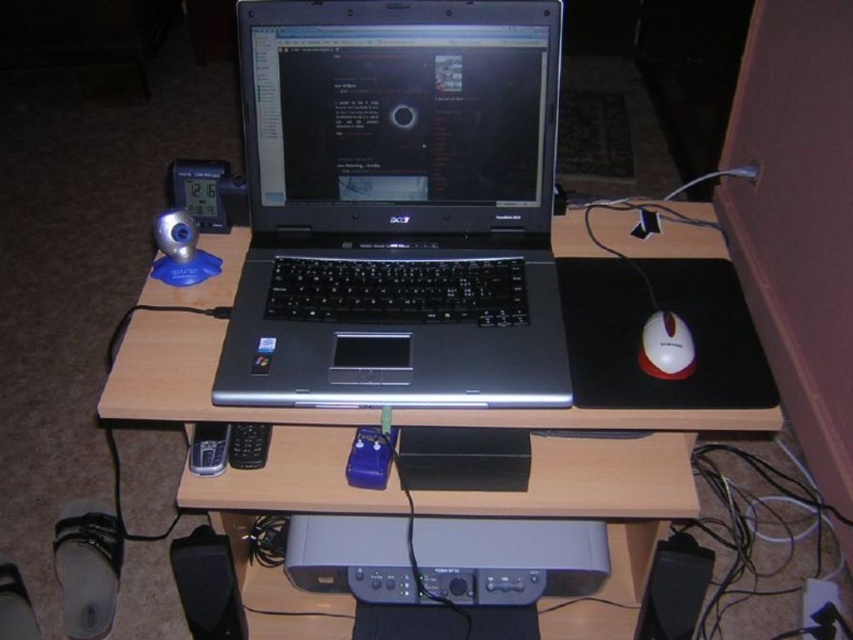
Question: Can you confirm if satin black laptop at center is positioned to the right of white glossy mouse at right?

Choices:
 (A) yes
 (B) no

Answer: (B)

Question: Which point is closer to the camera taking this photo?

Choices:
 (A) (535, 486)
 (B) (693, 580)

Answer: (A)

Question: Is the position of satin black laptop at center less distant than that of white glossy mouse at right?

Choices:
 (A) no
 (B) yes

Answer: (B)

Question: Which point appears farthest from the camera in this image?

Choices:
 (A) (537, 310)
 (B) (675, 326)
 (C) (680, 403)

Answer: (A)

Question: Where is satin silver laptop at center located in relation to white glossy mouse at right in the image?

Choices:
 (A) above
 (B) below

Answer: (B)

Question: Which object appears farthest from the camera in this image?

Choices:
 (A) black plastic speaker at lower right
 (B) white glossy mouse at right
 (C) satin silver laptop at center
 (D) satin black laptop at center

Answer: (A)